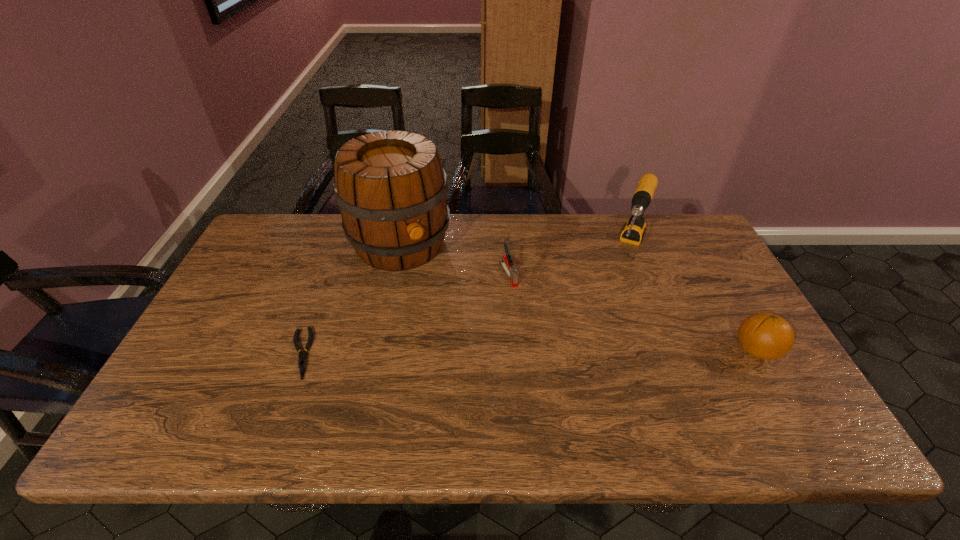
Select which object appears as the fourth closest to the stapler. Please provide its 2D coordinates. Your answer should be formatted as a tuple, i.e. [(x, y)], where the tuple contains the x and y coordinates of a point satisfying the conditions above.

[(767, 336)]

Find the location of a particular element. free location that satisfies the following two spatial constraints: 1. on the back side of the shortest object; 2. on the right side of the stapler is located at coordinates (329, 274).

Where is `free spot that satisfies the following two spatial constraints: 1. on the front side of the cider; 2. on the right side of the third object from right to left`? free spot that satisfies the following two spatial constraints: 1. on the front side of the cider; 2. on the right side of the third object from right to left is located at coordinates (394, 274).